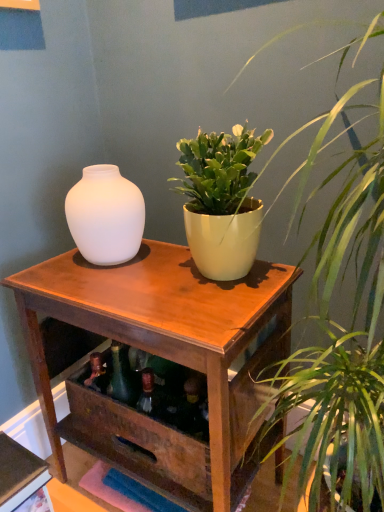
Question: Is green matte plant pot at center, the 2th houseplant when ordered from bottom to top, at the left side of wooden table at center?

Choices:
 (A) no
 (B) yes

Answer: (A)

Question: Does green matte plant pot at center, the 2th houseplant when ordered from bottom to top, have a lesser width compared to wooden table at center?

Choices:
 (A) no
 (B) yes

Answer: (B)

Question: Would you say green matte plant pot at center, the 2th houseplant when ordered from bottom to top, contains wooden table at center?

Choices:
 (A) yes
 (B) no

Answer: (B)

Question: Is green matte plant pot at center, marked as the 1th houseplant in a top-to-bottom arrangement, further to camera compared to wooden table at center?

Choices:
 (A) yes
 (B) no

Answer: (A)

Question: From the image's perspective, is green matte plant pot at center, the 2th houseplant when ordered from bottom to top, under wooden table at center?

Choices:
 (A) yes
 (B) no

Answer: (B)

Question: Visually, is matte white vase at left positioned to the left or to the right of matte yellow pot at upper center, placed as the 1th houseplant when sorted from bottom to top?

Choices:
 (A) left
 (B) right

Answer: (A)

Question: From the image's perspective, is matte white vase at left positioned above or below matte yellow pot at upper center, marked as the 2th houseplant in a top-to-bottom arrangement?

Choices:
 (A) above
 (B) below

Answer: (A)

Question: From a real-world perspective, relative to matte yellow pot at upper center, marked as the 2th houseplant in a top-to-bottom arrangement, is matte white vase at left vertically above or below?

Choices:
 (A) below
 (B) above

Answer: (B)

Question: Is matte white vase at left inside or outside of matte yellow pot at upper center, placed as the 1th houseplant when sorted from bottom to top?

Choices:
 (A) outside
 (B) inside

Answer: (A)

Question: Visually, is green matte plant pot at center, marked as the 1th houseplant in a top-to-bottom arrangement, positioned to the left or to the right of matte yellow pot at upper center, marked as the 2th houseplant in a top-to-bottom arrangement?

Choices:
 (A) left
 (B) right

Answer: (A)

Question: In terms of size, does green matte plant pot at center, the 2th houseplant when ordered from bottom to top, appear bigger or smaller than matte yellow pot at upper center, marked as the 2th houseplant in a top-to-bottom arrangement?

Choices:
 (A) small
 (B) big

Answer: (A)

Question: Is point coord(200,195) positioned closer to the camera than point coord(375,177)?

Choices:
 (A) closer
 (B) farther

Answer: (B)

Question: From a real-world perspective, relative to matte yellow pot at upper center, placed as the 1th houseplant when sorted from bottom to top, is green matte plant pot at center, the 2th houseplant when ordered from bottom to top, vertically above or below?

Choices:
 (A) above
 (B) below

Answer: (A)

Question: In the image, is wooden table at center on the left side or the right side of matte white vase at left?

Choices:
 (A) left
 (B) right

Answer: (B)

Question: Relative to matte white vase at left, is wooden table at center in front or behind?

Choices:
 (A) behind
 (B) front

Answer: (B)